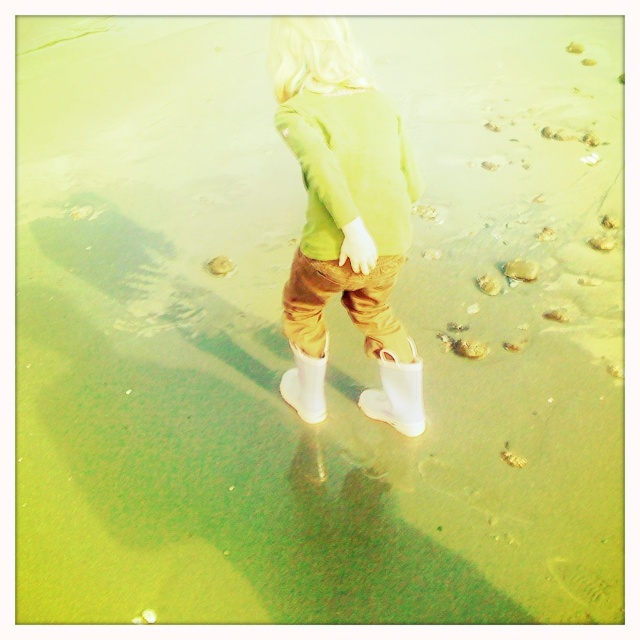
Question: Does white rubber boot at lower center have a lesser width compared to smooth sand footprint at center?

Choices:
 (A) no
 (B) yes

Answer: (A)

Question: Does white rubber boot at lower center have a greater width compared to white rubber boot at center?

Choices:
 (A) yes
 (B) no

Answer: (A)

Question: Does matte green sweater at center appear on the left side of smooth sand footprint at center?

Choices:
 (A) no
 (B) yes

Answer: (A)

Question: Which point is farther to the camera?

Choices:
 (A) white rubber boot at center
 (B) green matte sweatshirt at center

Answer: (A)

Question: Which of the following is the closest to the observer?

Choices:
 (A) green matte sweatshirt at center
 (B) smooth sand footprint at center
 (C) white rubber boot at lower center

Answer: (A)

Question: Which object is positioned farthest from the matte green sweater at center?

Choices:
 (A) white rubber boot at center
 (B) smooth sand footprint at center

Answer: (B)